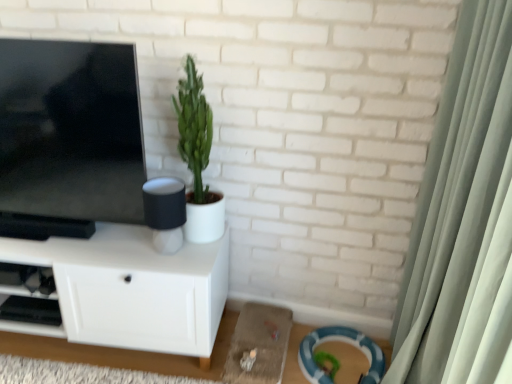
Where is `vacant space to the left of matte black speaker at center`? The width and height of the screenshot is (512, 384). vacant space to the left of matte black speaker at center is located at coordinates (121, 246).